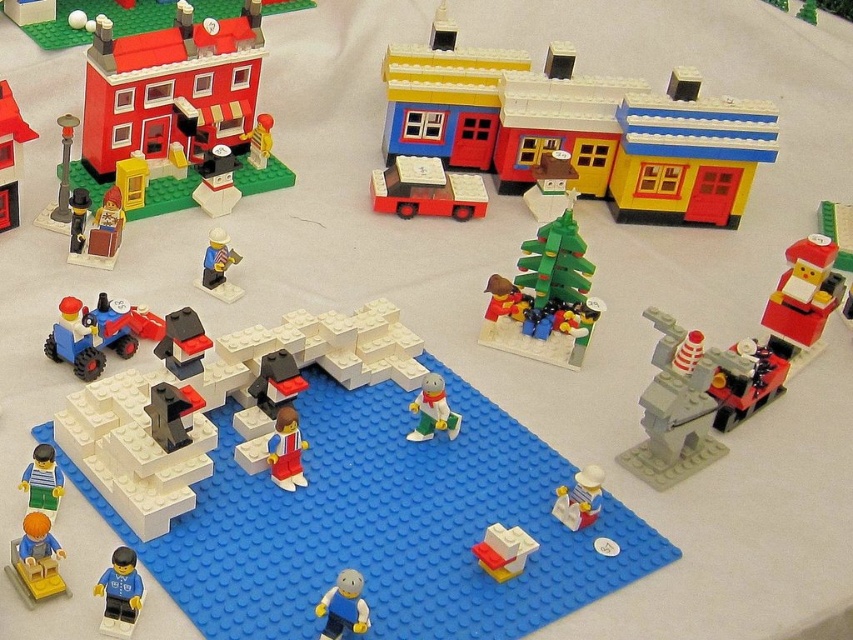
From the picture: You are a parent setting up a LEGO display for a child. You want to place the smooth plastic train at upper left and the translucent plastic cup at lower center so that they are exactly 36 inches apart. Can you achieve this with the current spacing between them?

The smooth plastic train at upper left and translucent plastic cup at lower center are currently 32.96 inches apart. To reach the desired 36 inches, you need to increase the distance between them by approximately 3.04 inches.

You are setting up a LEGO village and need to place both the green matte christmas tree at center and the orange matte figure at lower left on the blue baseplate. Based on their sizes, which object will occupy more space on the baseplate?

The green matte christmas tree at center has a larger size compared to the orange matte figure at lower left, so it will occupy more space on the baseplate.